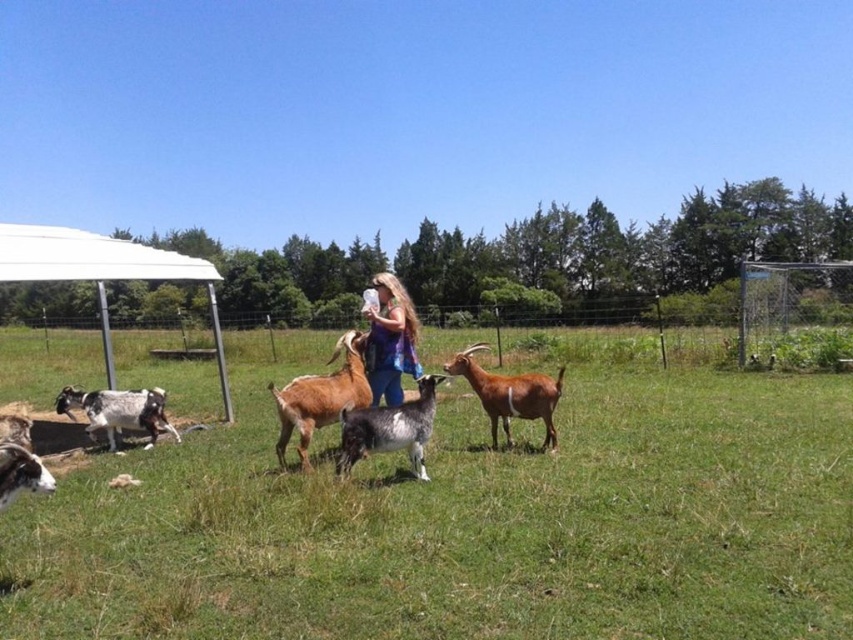
Question: Can you confirm if white plastic canopy at left is positioned to the right of brown woolen goat at center?

Choices:
 (A) no
 (B) yes

Answer: (A)

Question: Where is white plastic canopy at left located in relation to brown woolen goat at center in the image?

Choices:
 (A) below
 (B) above

Answer: (B)

Question: Among these objects, which one is farthest from the camera?

Choices:
 (A) green grassy field at center
 (B) gray speckled fur goat at center
 (C) white woolen goat at lower left
 (D) speckled fur goat at lower left

Answer: (D)

Question: Among these objects, which one is nearest to the camera?

Choices:
 (A) vibrant tie-dye shirt at center
 (B) green grassy field at center
 (C) speckled fur goat at lower left
 (D) gray speckled fur goat at center

Answer: (B)

Question: Is green grassy field at center smaller than gray speckled fur goat at center?

Choices:
 (A) no
 (B) yes

Answer: (A)

Question: Which object appears closest to the camera in this image?

Choices:
 (A) brown woolen goat at center
 (B) green grassy field at center

Answer: (B)